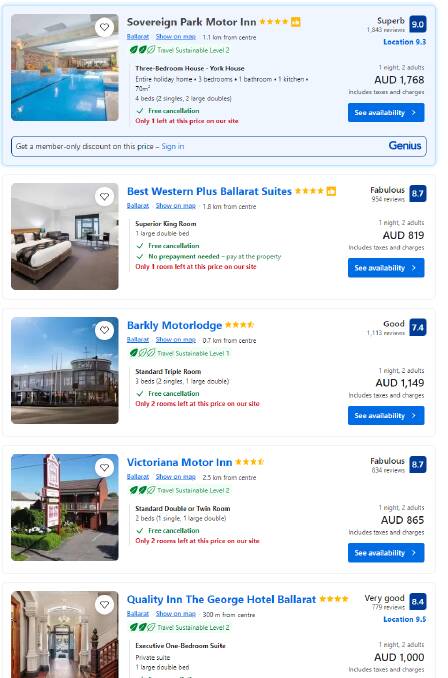
At what (x,y) coordinates should I click in order to perform the action: click on chair. Please return your answer as a coordinate pair (x, y). The width and height of the screenshot is (448, 678). Looking at the image, I should click on (105, 238), (89, 238).